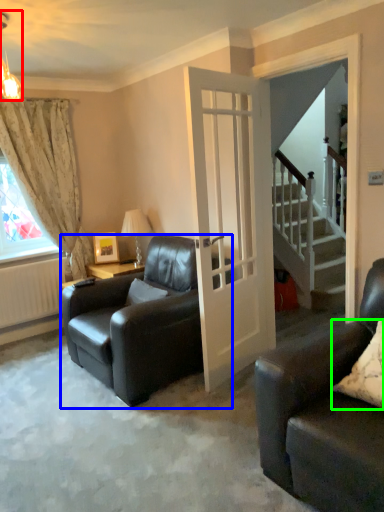
Question: Which object is the closest to the light fixture (highlighted by a red box)? Choose among these: chair (highlighted by a blue box) or pillow (highlighted by a green box).

Choices:
 (A) chair
 (B) pillow

Answer: (A)